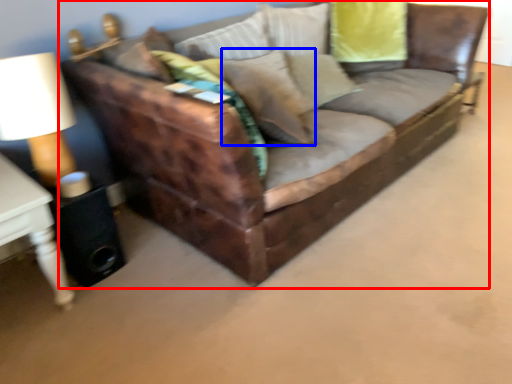
Question: Which of the following is the closest to the observer, studio couch (highlighted by a red box) or pillow (highlighted by a blue box)?

Choices:
 (A) studio couch
 (B) pillow

Answer: (A)